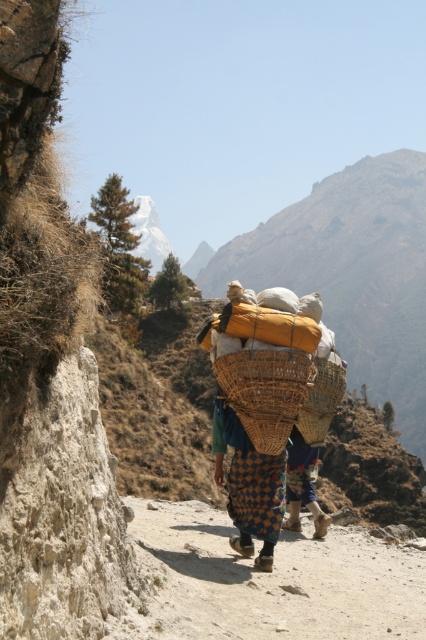
Who is more forward, [331,412] or [324,368]?

Point [324,368]

This screenshot has height=640, width=426. I want to click on brown woven basket at center, so click(267, 358).

Where is `brown woven basket at center`? This screenshot has width=426, height=640. brown woven basket at center is located at coordinates (267, 358).

Who is lower down, dusty gravel path at center or woven brown basket at center?

dusty gravel path at center is below.

Who is taller, dusty gravel path at center or woven brown basket at center?

With more height is dusty gravel path at center.

Where is `dusty gravel path at center`? This screenshot has height=640, width=426. dusty gravel path at center is located at coordinates (270, 580).

Is rugged brown mountain at center smaller than dusty gravel path at center?

Actually, rugged brown mountain at center might be larger than dusty gravel path at center.

Is rugged brown mountain at center to the right of dusty gravel path at center from the viewer's perspective?

Correct, you'll find rugged brown mountain at center to the right of dusty gravel path at center.

In order to click on rugged brown mountain at center in this screenshot , I will do pos(354,273).